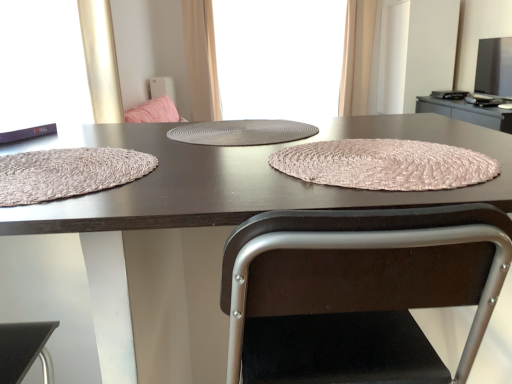
Question: Is matte brown placemat at center wider or thinner than beige fabric curtain at upper right, the first curtain when ordered from right to left?

Choices:
 (A) wide
 (B) thin

Answer: (A)

Question: Is point (33, 145) closer or farther from the camera than point (358, 48)?

Choices:
 (A) closer
 (B) farther

Answer: (A)

Question: Based on their relative distances, which object is farther from the beige fabric curtain at upper center, marked as the second curtain in a right-to-left arrangement?

Choices:
 (A) gray woven placemat at center, placed as the 1th window screen when sorted from top to bottom
 (B) rustic woven placemat at left, the first blanket positioned from the left
 (C) gray textured placemat at center
 (D) matte brown placemat at center
 (E) beige fabric curtain at upper right, the first curtain when ordered from right to left

Answer: (B)

Question: Which of these objects is positioned closest to the matte brown placemat at center?

Choices:
 (A) matte black book at left, which appears as the first window screen when ordered from the bottom
 (B) beige fabric curtain at upper right, the first curtain when ordered from right to left
 (C) pink woven placemat at center, the 1th blanket from the right
 (D) gray textured placemat at center
 (E) rustic woven placemat at left, the 2th blanket positioned from the right

Answer: (C)